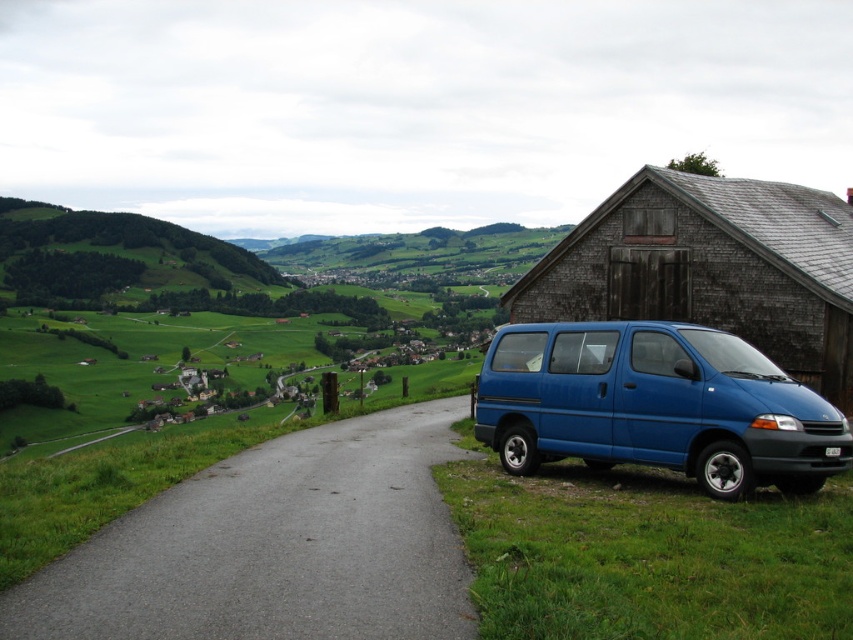
Question: Which object is closer to the camera taking this photo?

Choices:
 (A) blue matte van at lower right
 (B) green grassy hillside at upper left

Answer: (A)

Question: Can you confirm if gray asphalt road at center is positioned to the right of blue matte van at lower right?

Choices:
 (A) yes
 (B) no

Answer: (B)

Question: Which point is closer to the camera?

Choices:
 (A) wooden barn at right
 (B) gray asphalt road at center

Answer: (B)

Question: Can you confirm if wooden barn at right is positioned above green grassy hillside at upper left?

Choices:
 (A) no
 (B) yes

Answer: (A)

Question: Which object is closer to the camera taking this photo?

Choices:
 (A) wooden barn at right
 (B) blue matte van at lower right

Answer: (B)

Question: Does gray asphalt road at center appear over blue matte van at lower right?

Choices:
 (A) no
 (B) yes

Answer: (A)